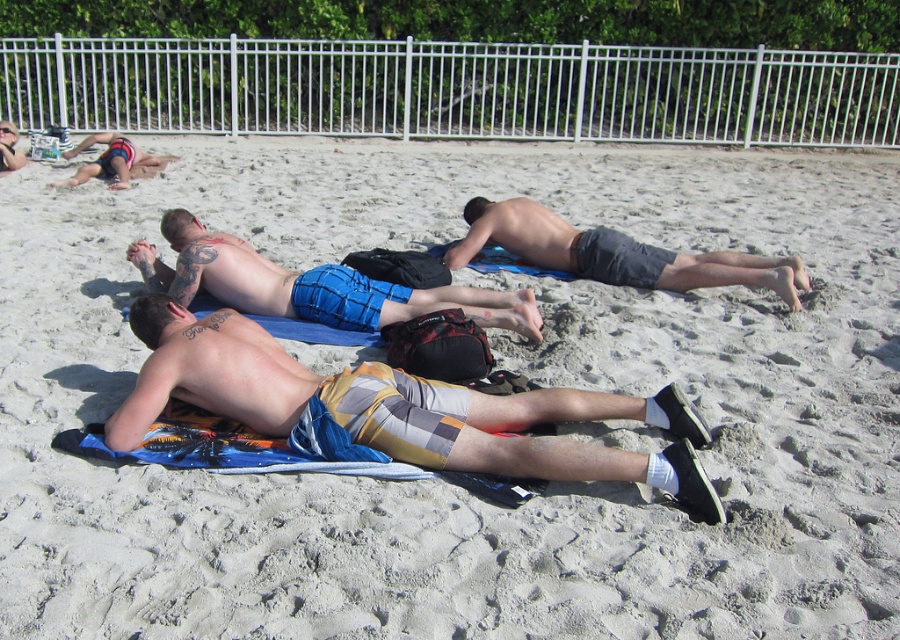
Question: Considering the relative positions of blue plaid shorts at center and dark gray shorts at center in the image provided, where is blue plaid shorts at center located with respect to dark gray shorts at center?

Choices:
 (A) above
 (B) below

Answer: (B)

Question: Based on their relative distances, which object is farther from the dark gray shorts at center?

Choices:
 (A) blue plaid shorts at center
 (B) matte black shorts at upper left
 (C) plaid shorts at center

Answer: (B)

Question: Is blue plaid shorts at center closer to the viewer compared to matte black shorts at upper left?

Choices:
 (A) yes
 (B) no

Answer: (A)

Question: Which object appears closest to the camera in this image?

Choices:
 (A) blue plaid shorts at center
 (B) dark gray shorts at center
 (C) matte black shorts at upper left
 (D) plaid shorts at center

Answer: (D)

Question: Is blue plaid shorts at center bigger than matte black shorts at upper left?

Choices:
 (A) no
 (B) yes

Answer: (A)

Question: Which object is farther from the camera taking this photo?

Choices:
 (A) plaid shorts at center
 (B) blue plaid shorts at center
 (C) dark gray shorts at center

Answer: (C)